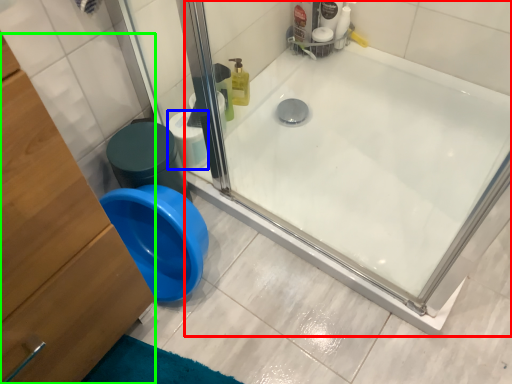
Question: Which is nearer to the bathtub (highlighted by a red box)? toilet paper (highlighted by a blue box) or dresser (highlighted by a green box).

Choices:
 (A) toilet paper
 (B) dresser

Answer: (A)